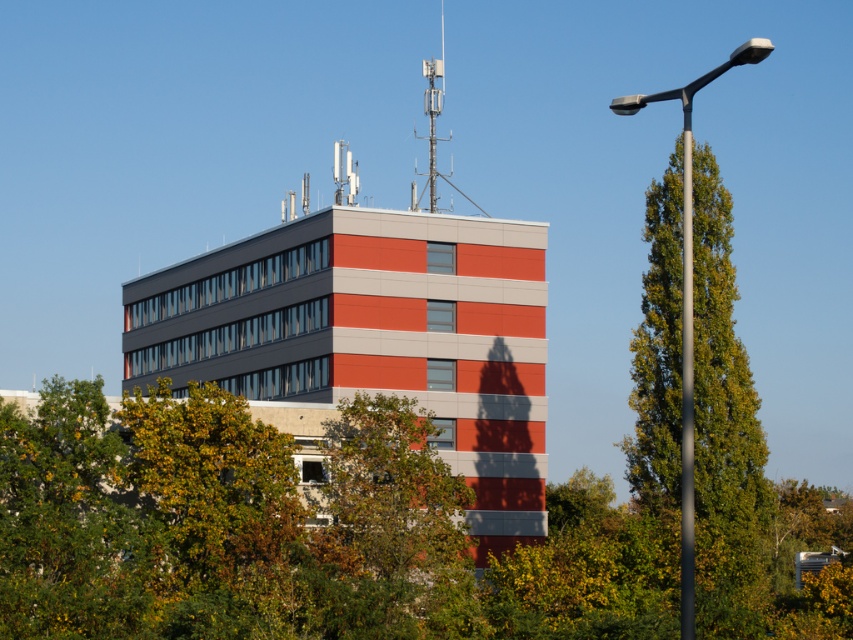
Is green leafy tree at center in front of red brick building at center?

Yes, green leafy tree at center is in front of red brick building at center.

Is point (567, 499) closer to viewer compared to point (490, 540)?

No, it is behind (490, 540).

Image resolution: width=853 pixels, height=640 pixels. I want to click on green leafy tree at center, so click(291, 532).

What are the coordinates of `green leafy tree at center` in the screenshot? It's located at (291, 532).

Does green leafy tree at center appear over sleek metallic pole at right?

No.

Does point (229, 435) come behind point (746, 44)?

No, it is in front of (746, 44).

Find the location of a particular element. The height and width of the screenshot is (640, 853). green leafy tree at center is located at coordinates (291, 532).

Is point (529, 433) closer to viewer compared to point (683, 336)?

No, (529, 433) is behind (683, 336).

Is red brick building at center positioned before metallic gray pole at right?

No, red brick building at center is behind metallic gray pole at right.

This screenshot has height=640, width=853. What do you see at coordinates (373, 332) in the screenshot?
I see `red brick building at center` at bounding box center [373, 332].

The image size is (853, 640). In order to click on red brick building at center in this screenshot , I will do `click(373, 332)`.